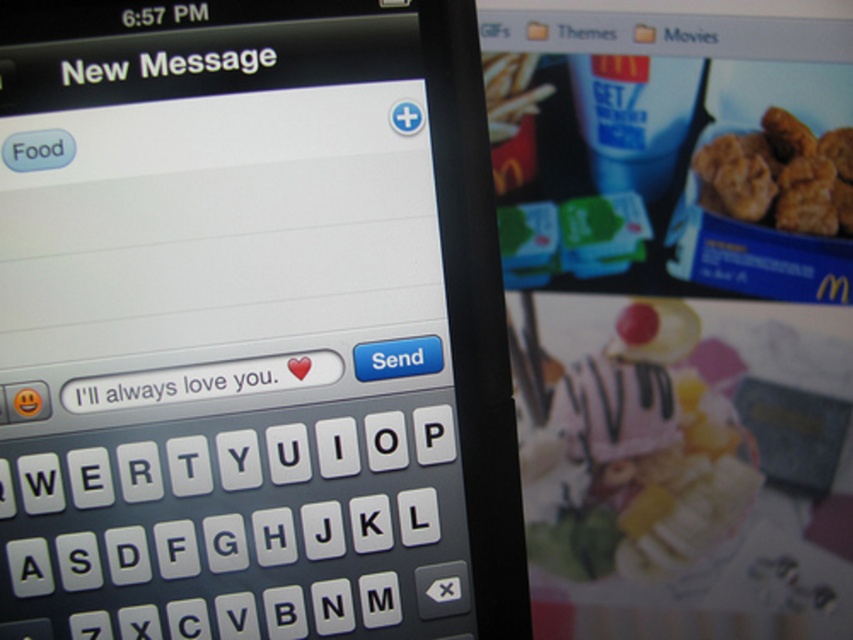
Can you confirm if white plastic keyboard at center is smaller than white matte text message at center?

Incorrect, white plastic keyboard at center is not smaller in size than white matte text message at center.

Is point (225, 435) less distant than point (283, 385)?

That is True.

Locate an element on the screen. white plastic keyboard at center is located at coordinates (238, 528).

Between black plastic smartphone at center and white plastic keyboard at center, which one is positioned lower?

white plastic keyboard at center is below.

Between black plastic smartphone at center and white plastic keyboard at center, which one has less height?

white plastic keyboard at center is shorter.

Identify the location of black plastic smartphone at center. Image resolution: width=853 pixels, height=640 pixels. (253, 323).

Locate an element on the screen. The image size is (853, 640). black plastic smartphone at center is located at coordinates (253, 323).

Does point (398, 628) lie behind point (712, 147)?

No, it is in front of (712, 147).

Can you confirm if white plastic keyboard at center is bigger than golden crispy nuggets at upper right?

Yes, white plastic keyboard at center is bigger than golden crispy nuggets at upper right.

You are a GUI agent. You are given a task and a screenshot of the screen. Output one action in this format:
    pyautogui.click(x=<x>, y=<y>)
    Task: Click on the white plastic keyboard at center
    The width and height of the screenshot is (853, 640).
    Given the screenshot: What is the action you would take?
    pyautogui.click(x=238, y=528)